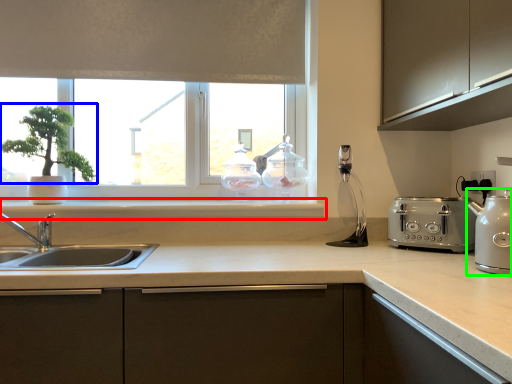
Question: Which object is positioned closest to window sill (highlighted by a red box)? Select from plant (highlighted by a blue box) and kitchen appliance (highlighted by a green box).

Choices:
 (A) plant
 (B) kitchen appliance

Answer: (A)